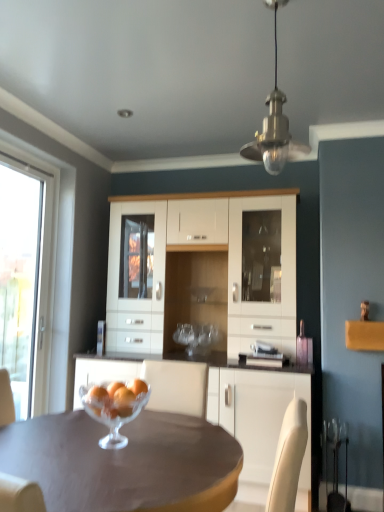
Question: Is orange matte glass bowl at center bigger or smaller than matte brown table at center?

Choices:
 (A) big
 (B) small

Answer: (B)

Question: From a real-world perspective, is orange matte glass bowl at center positioned above or below matte brown table at center?

Choices:
 (A) above
 (B) below

Answer: (A)

Question: Based on their relative distances, which object is farther from the clear glass bowl at center?

Choices:
 (A) transparent glass window at left
 (B) matte brown table at center
 (C) white glossy cabinet at center
 (D) metallic brass pendant light at upper center
 (E) orange matte glass bowl at center

Answer: (A)

Question: Considering the real-world distances, which object is farthest from the matte brown table at center?

Choices:
 (A) white glossy cabinet at center
 (B) orange matte glass bowl at center
 (C) transparent glass window at left
 (D) metallic brass pendant light at upper center
 (E) white glossy cabinet at center

Answer: (C)